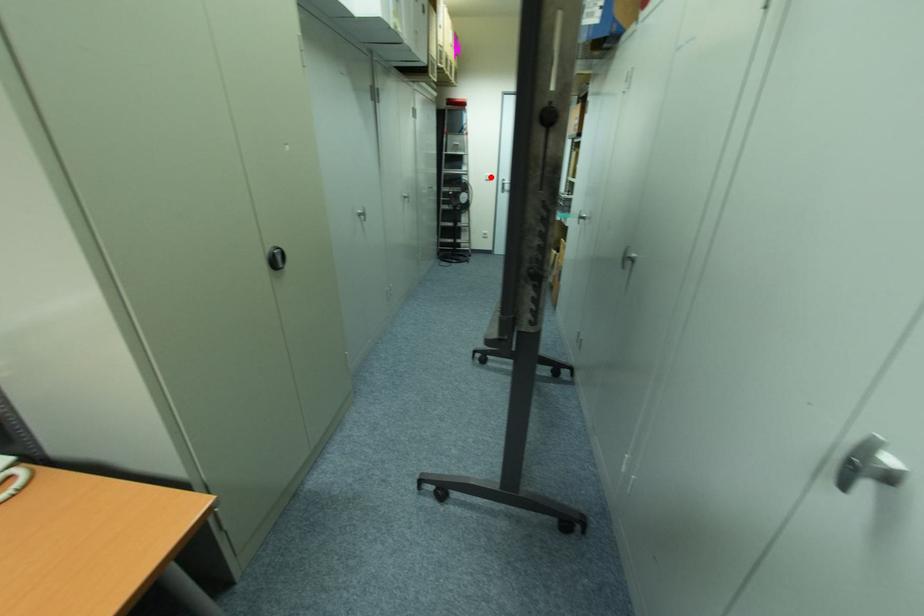
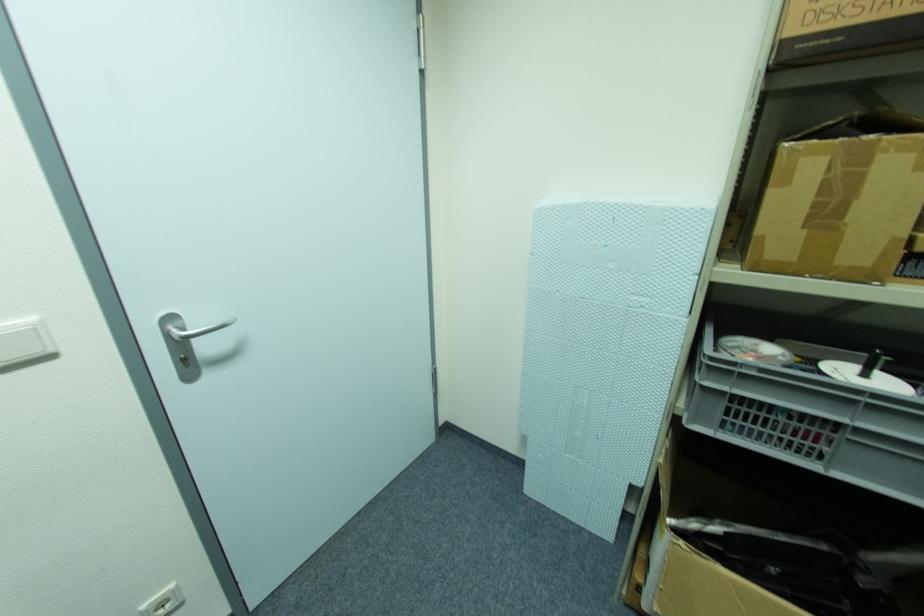
The point at the highlighted location is marked in the first image. Where is the corresponding point in the second image?

(34, 331)